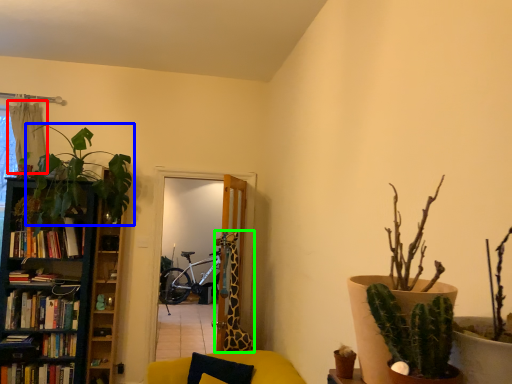
Question: Considering the real-world distances, which object is closest to curtain (highlighted by a red box)? houseplant (highlighted by a blue box) or giraffe (highlighted by a green box).

Choices:
 (A) houseplant
 (B) giraffe

Answer: (A)